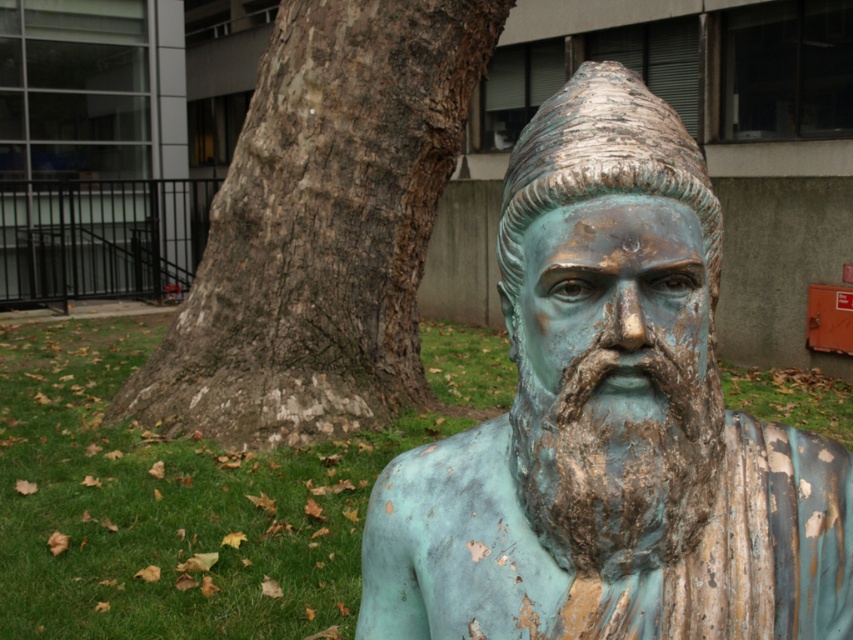
How much distance is there between green patina bronze bust at center and green patina beard at center?

green patina bronze bust at center is 1.71 inches away from green patina beard at center.

Does point (549, 518) come behind point (714, 372)?

No, (549, 518) is closer to viewer.

Locate an element on the screen. The height and width of the screenshot is (640, 853). green patina bronze bust at center is located at coordinates (611, 422).

Between green patina bronze bust at center and brown textured bark at center, which one has more height?

brown textured bark at center

Is green patina bronze bust at center to the left of brown textured bark at center from the viewer's perspective?

In fact, green patina bronze bust at center is to the right of brown textured bark at center.

Is point (598, 76) less distant than point (329, 330)?

Yes, point (598, 76) is closer to viewer.

This screenshot has width=853, height=640. Identify the location of green patina bronze bust at center. (611, 422).

Who is positioned more to the left, brown textured bark at center or green grass at lower left?

From the viewer's perspective, brown textured bark at center appears more on the left side.

Can you confirm if brown textured bark at center is bigger than green grass at lower left?

Indeed, brown textured bark at center has a larger size compared to green grass at lower left.

Is point (306, 257) more distant than point (822, 417)?

No, it is in front of (822, 417).

Identify the location of brown textured bark at center. The width and height of the screenshot is (853, 640). (322, 227).